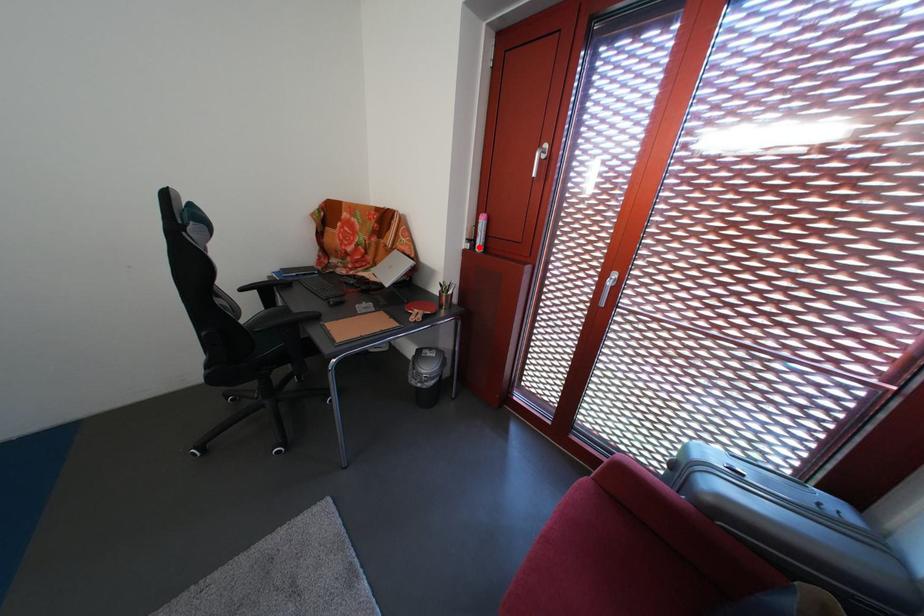
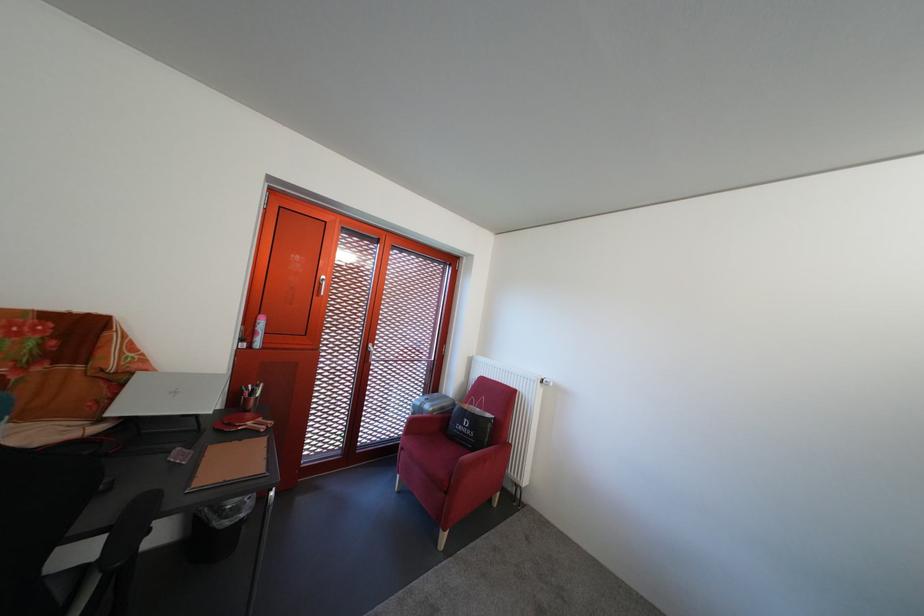
Find the pixel in the second image that matches the highlighted location in the first image.

(252, 346)